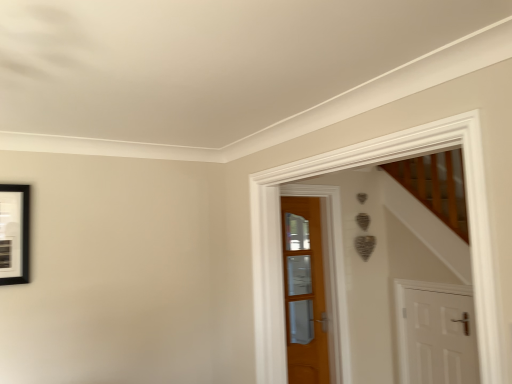
Question: Which direction should I rotate to face wooden door at center, which ranks as the 2th door in right-to-left order, — up or down?

Choices:
 (A) down
 (B) up

Answer: (A)

Question: From a real-world perspective, is white matte door at lower right, acting as the second door starting from the left, positioned under wooden door at center, arranged as the 1th door when viewed from the left, based on gravity?

Choices:
 (A) no
 (B) yes

Answer: (B)

Question: Is white matte door at lower right, positioned as the 1th door in right-to-left order, bigger than wooden door at center, arranged as the 1th door when viewed from the left?

Choices:
 (A) no
 (B) yes

Answer: (B)

Question: Is the depth of white matte door at lower right, positioned as the 1th door in right-to-left order, greater than that of wooden door at center, arranged as the 1th door when viewed from the left?

Choices:
 (A) no
 (B) yes

Answer: (A)

Question: Would you say white matte door at lower right, positioned as the 1th door in right-to-left order, contains wooden door at center, arranged as the 1th door when viewed from the left?

Choices:
 (A) no
 (B) yes

Answer: (A)

Question: From the image's perspective, is white matte door at lower right, acting as the second door starting from the left, above wooden door at center, arranged as the 1th door when viewed from the left?

Choices:
 (A) yes
 (B) no

Answer: (B)

Question: Is white matte door at lower right, positioned as the 1th door in right-to-left order, at the left side of wooden door at center, arranged as the 1th door when viewed from the left?

Choices:
 (A) yes
 (B) no

Answer: (B)

Question: Is wooden door at center, which ranks as the 2th door in right-to-left order, wider than white matte door at lower right, acting as the second door starting from the left?

Choices:
 (A) yes
 (B) no

Answer: (B)

Question: Is there a large distance between wooden door at center, which ranks as the 2th door in right-to-left order, and white matte door at lower right, positioned as the 1th door in right-to-left order?

Choices:
 (A) no
 (B) yes

Answer: (A)

Question: Considering the relative sizes of wooden door at center, which ranks as the 2th door in right-to-left order, and white matte door at lower right, acting as the second door starting from the left, in the image provided, is wooden door at center, which ranks as the 2th door in right-to-left order, shorter than white matte door at lower right, acting as the second door starting from the left,?

Choices:
 (A) yes
 (B) no

Answer: (B)

Question: Is wooden door at center, which ranks as the 2th door in right-to-left order, surrounding white matte door at lower right, acting as the second door starting from the left?

Choices:
 (A) yes
 (B) no

Answer: (B)

Question: Is wooden door at center, which ranks as the 2th door in right-to-left order, taller than white matte door at lower right, positioned as the 1th door in right-to-left order?

Choices:
 (A) no
 (B) yes

Answer: (B)

Question: Is wooden door at center, which ranks as the 2th door in right-to-left order, turned away from white matte door at lower right, positioned as the 1th door in right-to-left order?

Choices:
 (A) yes
 (B) no

Answer: (B)

Question: From their relative heights in the image, would you say white matte door at lower right, positioned as the 1th door in right-to-left order, is taller or shorter than wooden door at center, which ranks as the 2th door in right-to-left order?

Choices:
 (A) tall
 (B) short

Answer: (B)